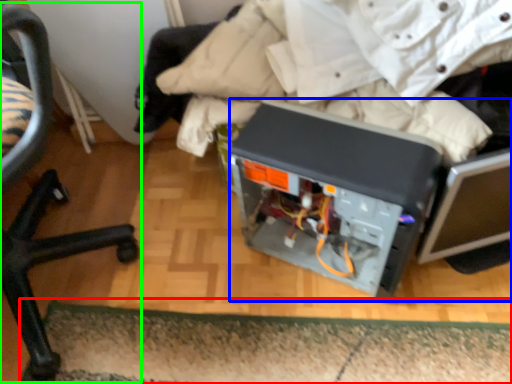
Question: Which object is the closest to the doormat (highlighted by a red box)? Choose among these: wide (highlighted by a blue box) or chair (highlighted by a green box).

Choices:
 (A) wide
 (B) chair

Answer: (A)